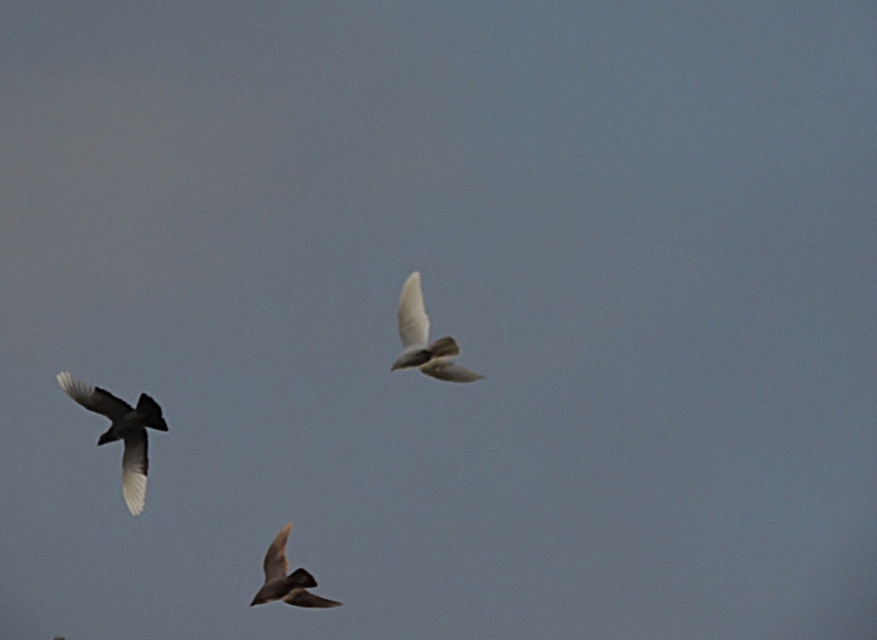
From the picture: Does white feathered bird at center come in front of brown feathered bird at lower center?

Yes.

Can you confirm if white feathered bird at center is thinner than brown feathered bird at lower center?

Incorrect, white feathered bird at center's width is not less than brown feathered bird at lower center's.

The width and height of the screenshot is (877, 640). I want to click on white feathered bird at center, so click(424, 339).

Based on the photo, who is more distant from viewer, (123, 403) or (324, 605)?

The point (123, 403) is more distant.

Is point (137, 460) closer to viewer compared to point (302, 570)?

No.

Where is `dark brown feathered bird at left`? The image size is (877, 640). dark brown feathered bird at left is located at coordinates (120, 432).

Who is higher up, dark brown feathered bird at left or white feathered bird at center?

white feathered bird at center is above.

You are a GUI agent. You are given a task and a screenshot of the screen. Output one action in this format:
    pyautogui.click(x=<x>, y=<y>)
    Task: Click on the dark brown feathered bird at left
    The width and height of the screenshot is (877, 640).
    Given the screenshot: What is the action you would take?
    (x=120, y=432)